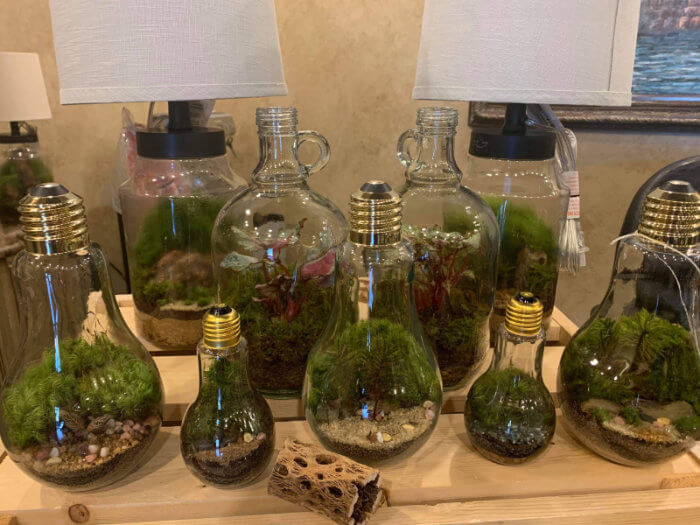
This screenshot has height=525, width=700. I want to click on lightbulb, so click(x=372, y=381), click(x=232, y=421), click(x=87, y=373), click(x=630, y=361).